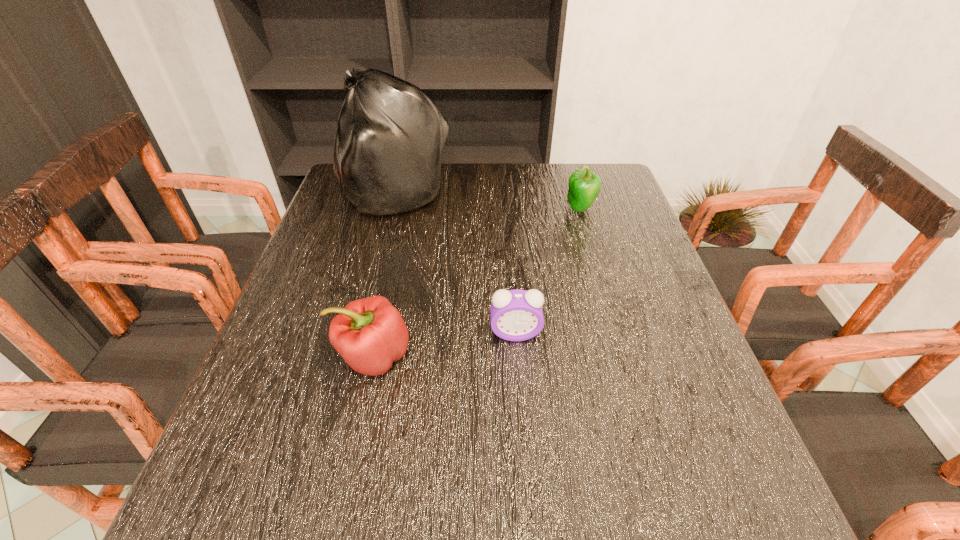
Select which object appears as the second closest to the left bell pepper. Please provide its 2D coordinates. Your answer should be formatted as a tuple, i.e. [(x, y)], where the tuple contains the x and y coordinates of a point satisfying the conditions above.

[(388, 147)]

Where is `object that stands as the third closest to the alarm clock`? The height and width of the screenshot is (540, 960). object that stands as the third closest to the alarm clock is located at coordinates (584, 186).